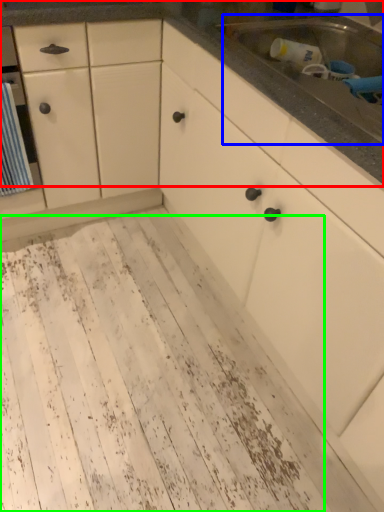
Question: Which object is the closest to the countertop (highlighted by a red box)? Choose among these: sink (highlighted by a blue box) or mud (highlighted by a green box).

Choices:
 (A) sink
 (B) mud

Answer: (A)